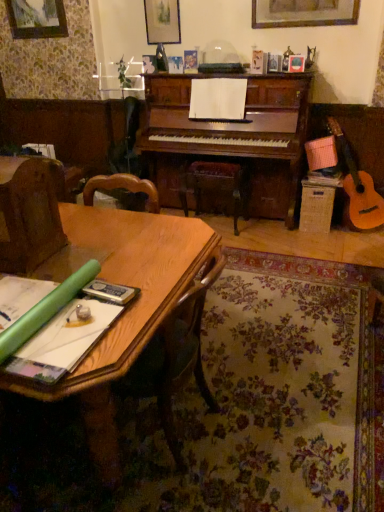
Question: Considering the positions of brown fabric armchair at left and wooden picture frame at upper left in the image, is brown fabric armchair at left taller or shorter than wooden picture frame at upper left?

Choices:
 (A) tall
 (B) short

Answer: (A)

Question: Is brown fabric armchair at left wider or thinner than wooden picture frame at upper left?

Choices:
 (A) thin
 (B) wide

Answer: (B)

Question: Estimate the real-world distances between objects in this image. Which object is closer to the brown fabric armchair at left?

Choices:
 (A) wooden at center
 (B) wooden picture frame at upper left
 (C) green paper at lower left
 (D) wooden table at lower left

Answer: (D)

Question: Which is farther from the green paper at lower left?

Choices:
 (A) brown fabric armchair at left
 (B) wooden at center
 (C) wooden picture frame at upper left
 (D) wooden table at lower left

Answer: (C)